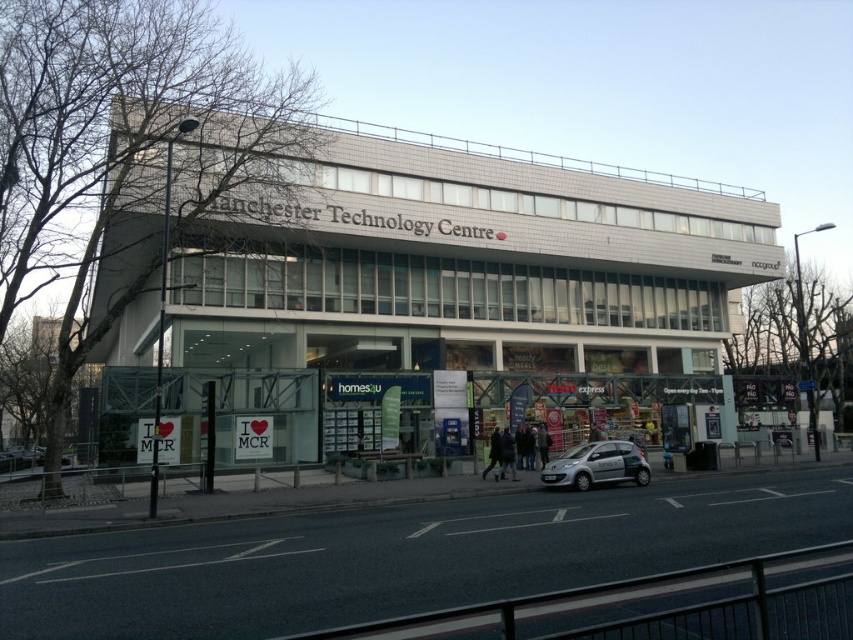
Does white glass building at center have a lesser height compared to silver metallic car at center?

No, white glass building at center is not shorter than silver metallic car at center.

Between white glass building at center and silver metallic car at center, which one is positioned lower?

silver metallic car at center is lower down.

Which is behind, point (519, 352) or point (590, 445)?

The point (519, 352) is more distant.

What are the coordinates of `white glass building at center` in the screenshot? It's located at (465, 268).